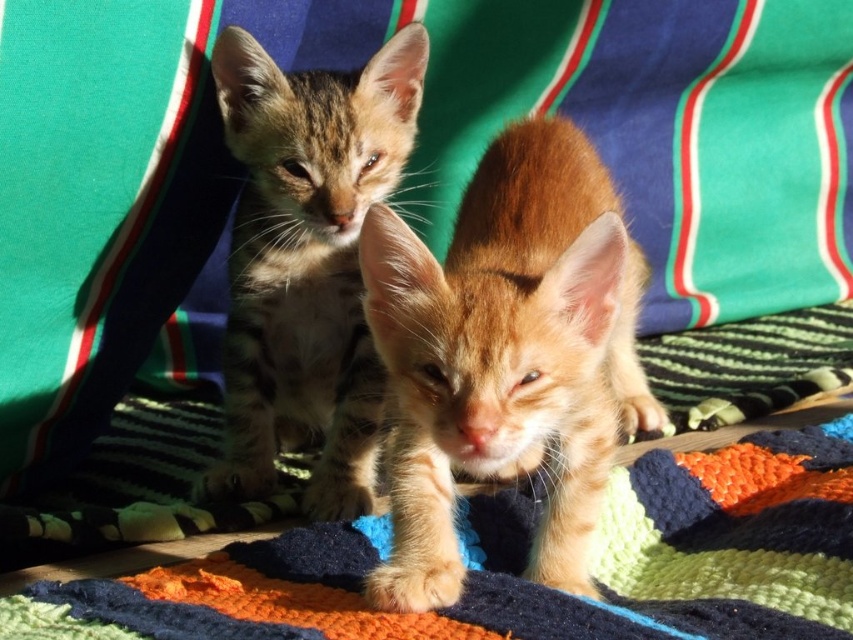
You are a photographer trying to capture both the knitted wool blanket at center and the tabby fur kitten at center in a single shot. Based on their positions, which object should you adjust your camera angle to focus on first to ensure both are in frame?

The knitted wool blanket at center is to the right of the tabby fur kitten at center. To capture both in a single shot, you should first focus on the tabby fur kitten at center and then adjust your angle to include the knitted wool blanket at center to its right.

You are a cat owner who wants to place a new toy between the orange fur kitten at center and the knitted wool blanket at center. Which object should the toy be closer to if you want it to be nearer to the taller object?

The toy should be placed closer to the orange fur kitten at center because it is taller than the knitted wool blanket at center.